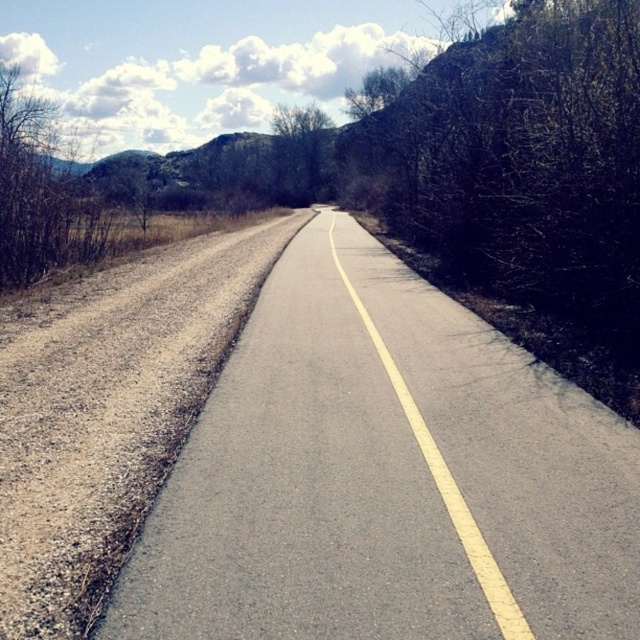
From the picture: You are driving a car and see the asphalt road at center and the green leafy tree at center in your view. Which object is positioned to the right side from your perspective?

The asphalt road at center is to the right of the green leafy tree at center, so the asphalt road at center is positioned to the right side from your perspective.

You are driving a car and see the asphalt road at center and the green leafy tree at center in the distance. Which object is closer to you?

The asphalt road at center is closer to you because it is 222.38 feet away from the green leafy tree at center, so the road is nearer than the tree.